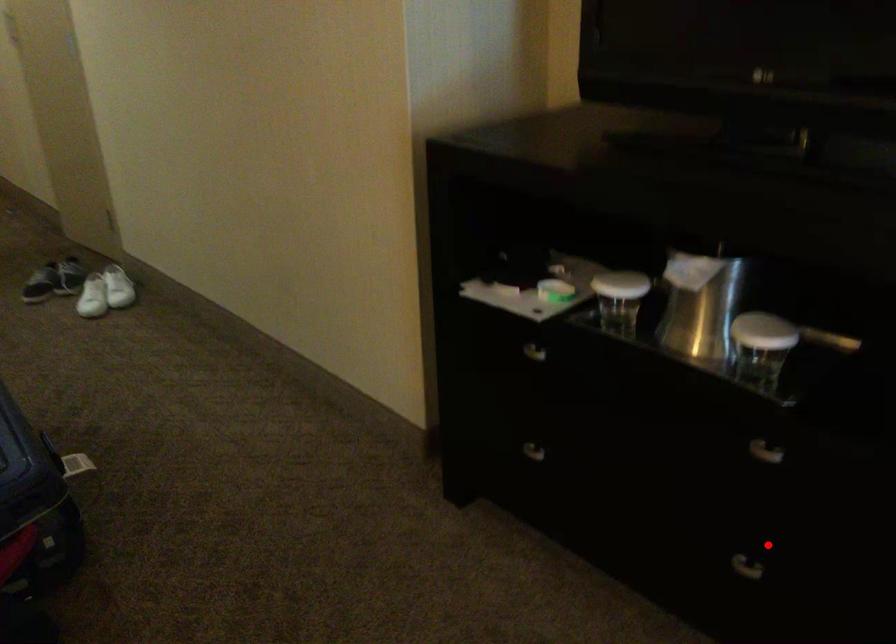
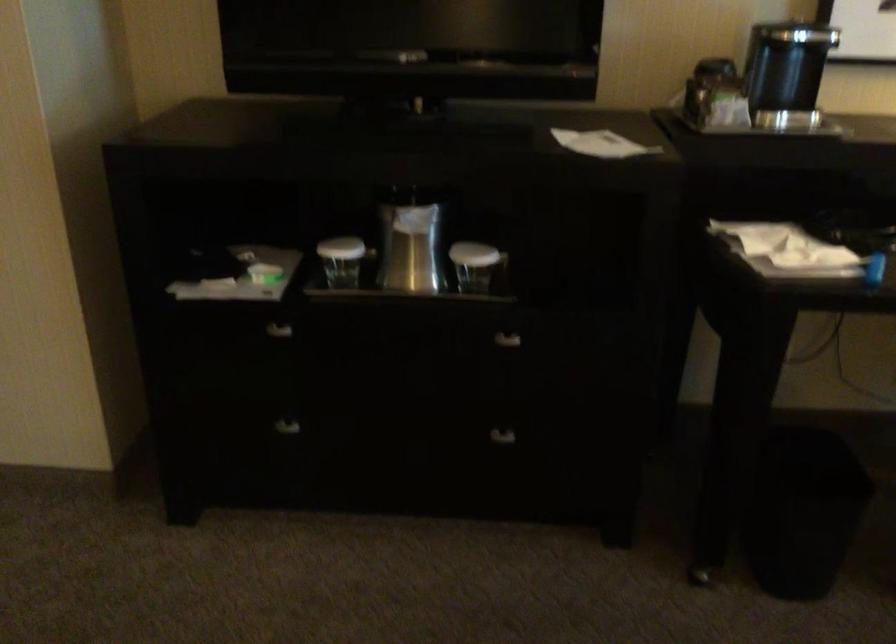
The point at the highlighted location is marked in the first image. Where is the corresponding point in the second image?

(495, 426)